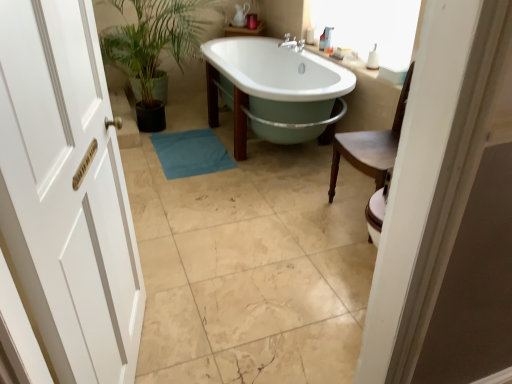
Question: In the image, is pastel green enamel bathtub at center on the left side or the right side of white wooden door at left?

Choices:
 (A) right
 (B) left

Answer: (A)

Question: Choose the correct answer: Is pastel green enamel bathtub at center inside white wooden door at left or outside it?

Choices:
 (A) outside
 (B) inside

Answer: (A)

Question: Estimate the real-world distances between objects in this image. Which object is closer to the white wooden door at left?

Choices:
 (A) teal fabric bath mat at center
 (B) white glossy sink at upper right
 (C) pastel green enamel bathtub at center

Answer: (A)

Question: Which object is positioned closest to the pastel green enamel bathtub at center?

Choices:
 (A) white glossy sink at upper right
 (B) teal fabric bath mat at center
 (C) white wooden door at left

Answer: (A)